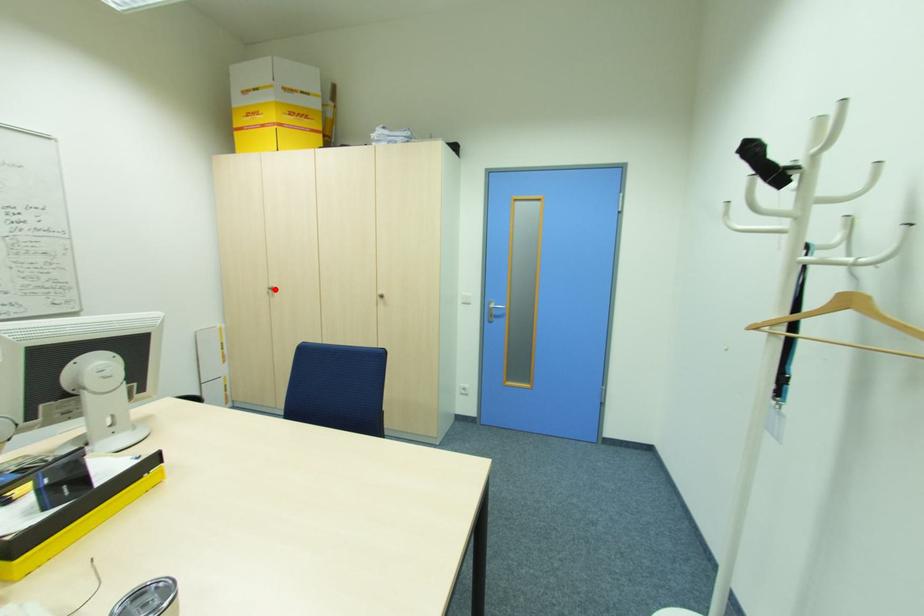
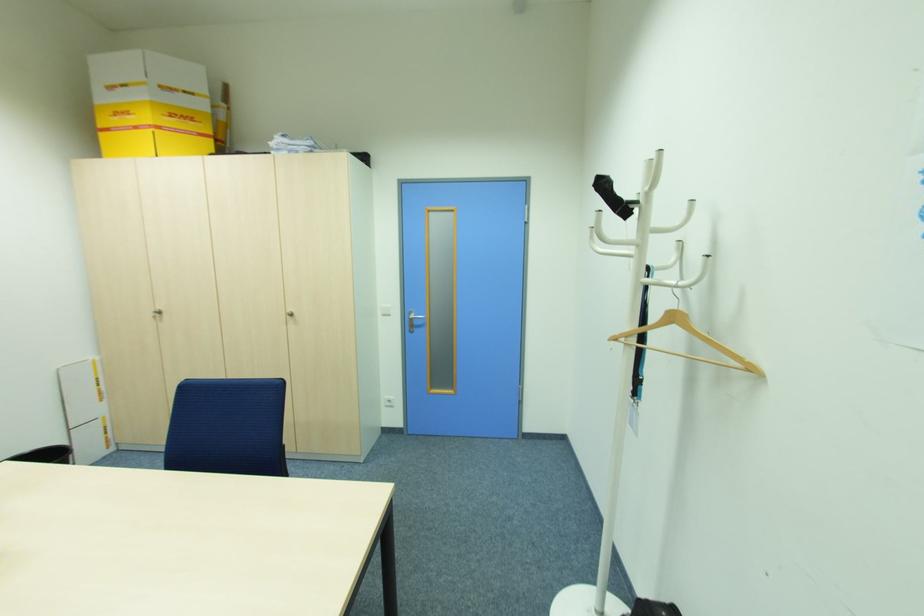
The point at the highlighted location is marked in the first image. Where is the corresponding point in the second image?

(162, 312)